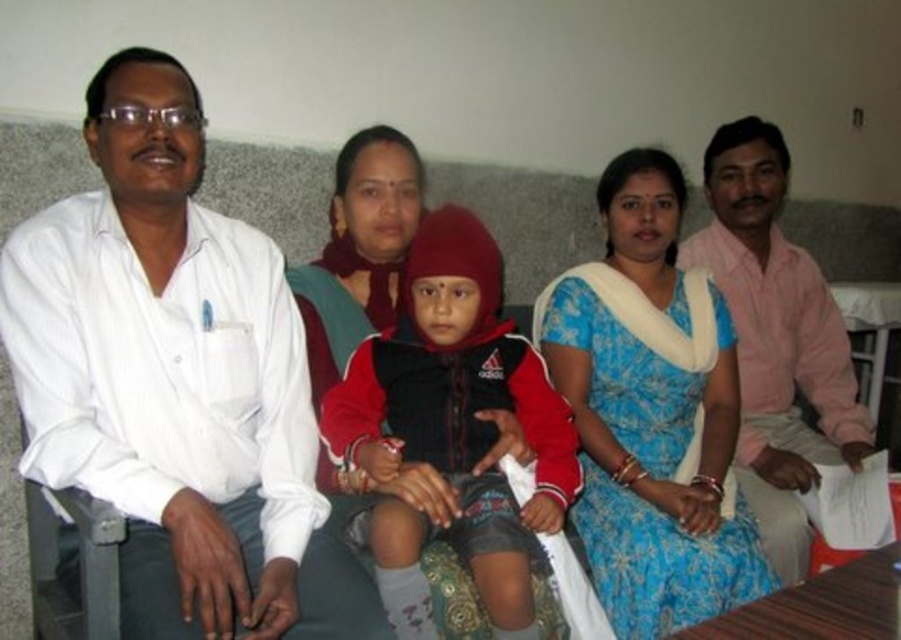
You are organizing a clothing donation drive and need to determine which item takes up more space in the donation box. Based on the image, which item is larger in size between the white shirt at left and the blue floral saree at center?

The blue floral saree at center is larger than the white shirt at left, so it takes up more space in the donation box.